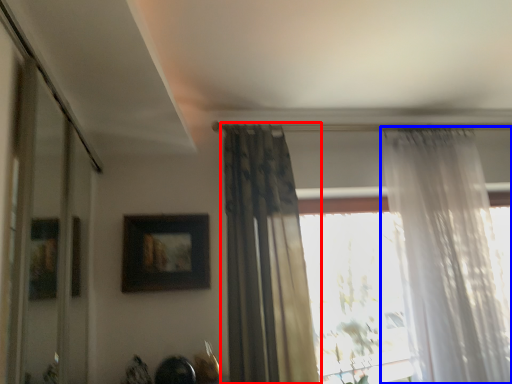
Question: Among these objects, which one is farthest to the camera, curtain (highlighted by a red box) or curtain (highlighted by a blue box)?

Choices:
 (A) curtain
 (B) curtain

Answer: (B)